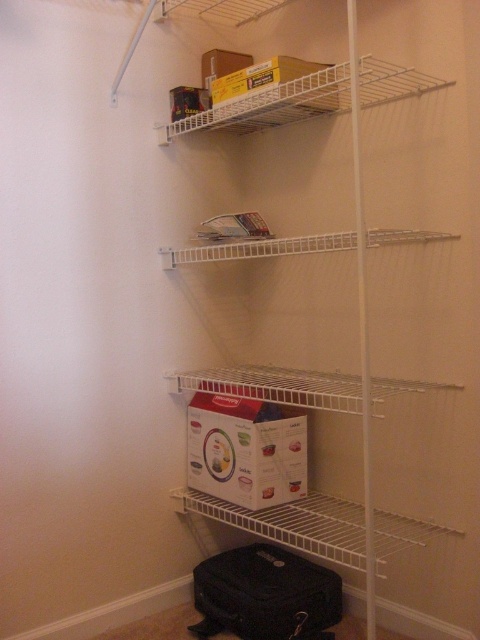
Question: Does white wire shelf at lower center appear under white wire shelf at upper center?

Choices:
 (A) no
 (B) yes

Answer: (B)

Question: Can you confirm if white wire shelf at lower center is smaller than white wire shelf at upper center?

Choices:
 (A) no
 (B) yes

Answer: (A)

Question: Which of the following is the closest to the observer?

Choices:
 (A) (253, 529)
 (B) (384, 100)

Answer: (B)

Question: Which object is closer to the camera taking this photo?

Choices:
 (A) white wire shelf at upper center
 (B) white wire shelf at lower center

Answer: (A)

Question: Which point is closer to the camera?

Choices:
 (A) (384, 522)
 (B) (260, 112)

Answer: (A)

Question: Is white wire shelf at lower center further to the viewer compared to white wire shelf at upper center?

Choices:
 (A) no
 (B) yes

Answer: (B)